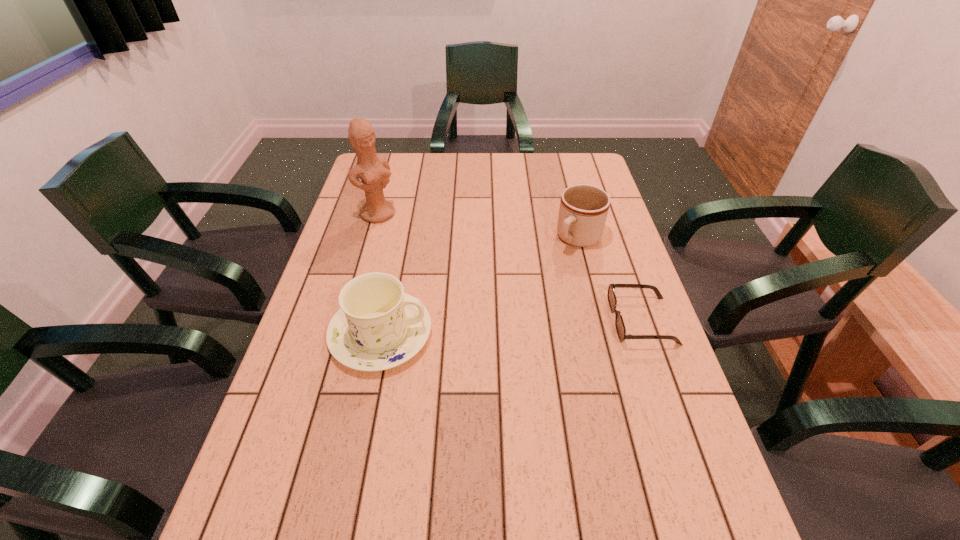
This screenshot has width=960, height=540. In the image, there is a desktop. What are the coordinates of `blank space at the far right corner` in the screenshot? It's located at (595, 170).

In order to click on free space at the near right corner of the desktop in this screenshot , I will do `click(654, 509)`.

This screenshot has width=960, height=540. What are the coordinates of `unoccupied position between the mug and the tallest object` in the screenshot? It's located at (478, 226).

Where is `free space between the sunglasses and the tallest object`? free space between the sunglasses and the tallest object is located at coordinates (510, 267).

I want to click on free area in between the mug and the tallest object, so click(x=478, y=226).

I want to click on vacant area that lies between the sunglasses and the chinaware, so click(512, 327).

Find the location of a particular element. free space between the shortest object and the tallest object is located at coordinates (510, 267).

Find the location of a particular element. This screenshot has height=540, width=960. free space between the chinaware and the shortest object is located at coordinates (512, 327).

Where is `free space between the chinaware and the mug`? This screenshot has height=540, width=960. free space between the chinaware and the mug is located at coordinates (480, 286).

Locate an element on the screen. This screenshot has height=540, width=960. vacant point located between the sunglasses and the figurine is located at coordinates (510, 267).